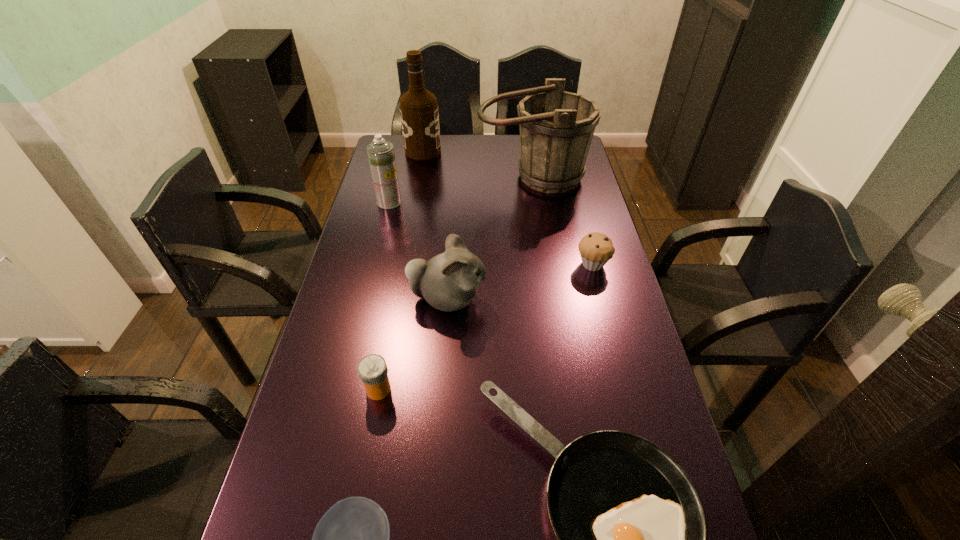
Find the location of a particular element. free area in between the tallest object and the medicine is located at coordinates (400, 270).

Image resolution: width=960 pixels, height=540 pixels. In order to click on object that is the third closest one to the frying pan in this screenshot , I will do `click(448, 281)`.

Locate an element on the screen. This screenshot has height=540, width=960. object that stands as the second closest to the hamster is located at coordinates (632, 539).

The height and width of the screenshot is (540, 960). I want to click on vacant position in the image that satisfies the following two spatial constraints: 1. on the label of the tallest object; 2. on the right side of the fifth nearest object, so click(402, 264).